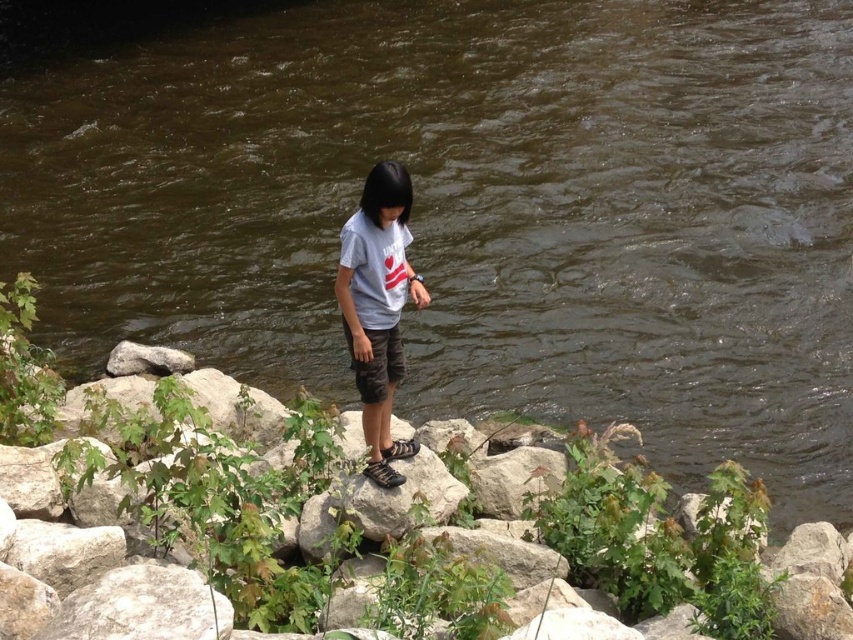
Question: Which point is closer to the camera?

Choices:
 (A) gray rough rock at lower left
 (B) white cotton shirt at center

Answer: (B)

Question: In this image, where is white cotton shirt at center located relative to gray rough rock at lower left?

Choices:
 (A) above
 (B) below

Answer: (A)

Question: Observing the image, what is the correct spatial positioning of brown stone at center in reference to gray rough rock at lower left?

Choices:
 (A) right
 (B) left

Answer: (A)

Question: Which object is closer to the camera taking this photo?

Choices:
 (A) brown cotton shorts at center
 (B) gray rough rock at lower left

Answer: (A)

Question: Considering the relative positions of brown stone at center and brown cotton shorts at center in the image provided, where is brown stone at center located with respect to brown cotton shorts at center?

Choices:
 (A) below
 (B) above

Answer: (A)

Question: Considering the real-world distances, which object is farthest from the white cotton shirt at center?

Choices:
 (A) gray rough rock at lower left
 (B) brown cotton shorts at center

Answer: (A)